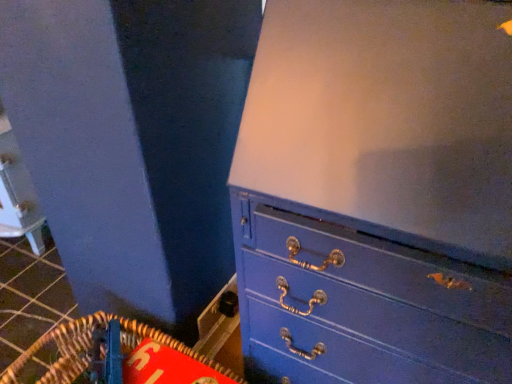
Describe the element at coordinates (115, 356) in the screenshot. I see `brown wicker basket at lower left` at that location.

Locate an element on the screen. The image size is (512, 384). brown wicker basket at lower left is located at coordinates (115, 356).

In order to click on brown wicker basket at lower left in this screenshot , I will do `click(115, 356)`.